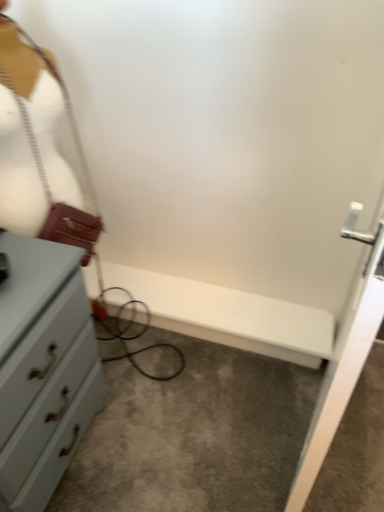
Locate an element on the screen. This screenshot has height=512, width=384. free location to the right of black cable at left is located at coordinates (137, 358).